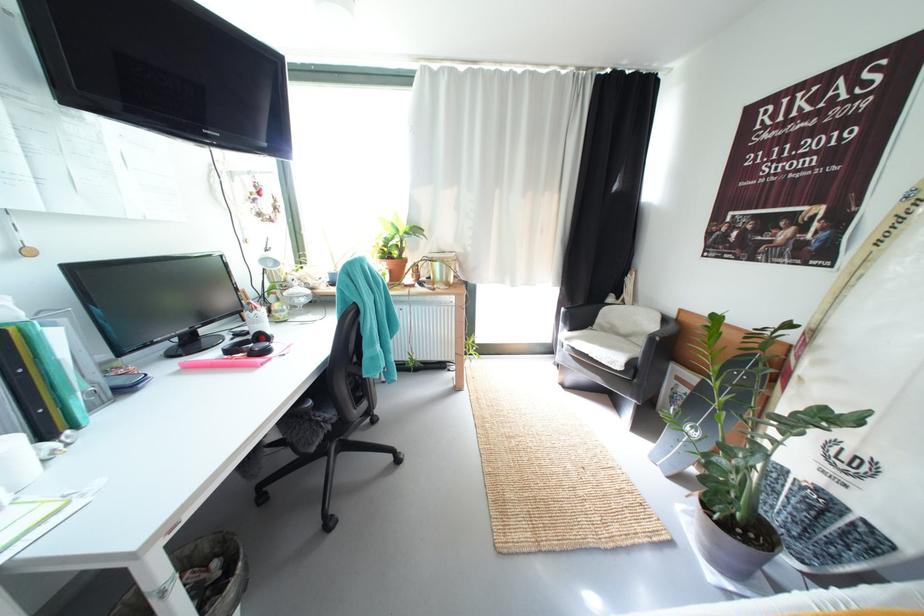
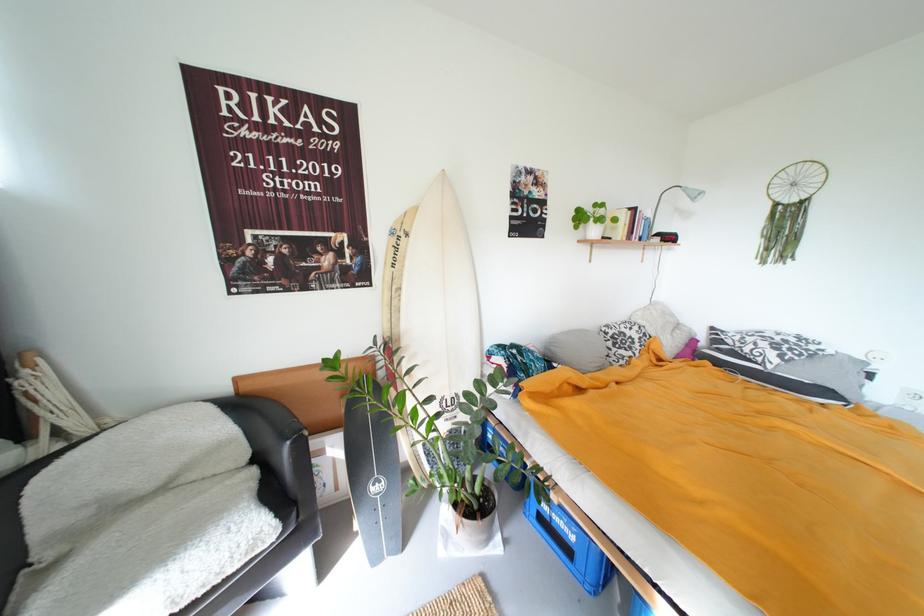
Find the pixel in the second image that matches [685,321] in the first image.

(246, 395)